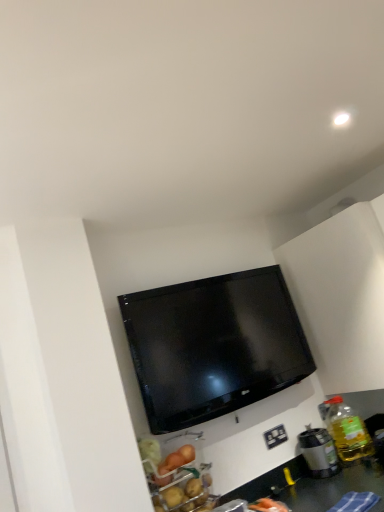
Question: Considering the relative sizes of metallic silver coffee maker at lower right and white plastic electrical outlet at lower right in the image provided, is metallic silver coffee maker at lower right wider than white plastic electrical outlet at lower right?

Choices:
 (A) no
 (B) yes

Answer: (B)

Question: Is white plastic electrical outlet at lower right at the back of metallic silver coffee maker at lower right?

Choices:
 (A) yes
 (B) no

Answer: (B)

Question: From a real-world perspective, is metallic silver coffee maker at lower right located higher than white plastic electrical outlet at lower right?

Choices:
 (A) no
 (B) yes

Answer: (A)

Question: Does metallic silver coffee maker at lower right have a larger size compared to white plastic electrical outlet at lower right?

Choices:
 (A) yes
 (B) no

Answer: (A)

Question: Considering the relative positions of metallic silver coffee maker at lower right and white plastic electrical outlet at lower right in the image provided, is metallic silver coffee maker at lower right to the left of white plastic electrical outlet at lower right from the viewer's perspective?

Choices:
 (A) yes
 (B) no

Answer: (B)

Question: From the image's perspective, is metallic silver coffee maker at lower right located beneath white plastic electrical outlet at lower right?

Choices:
 (A) yes
 (B) no

Answer: (A)

Question: Is translucent yellow bottle at right to the right of metallic silver coffee maker at lower right from the viewer's perspective?

Choices:
 (A) yes
 (B) no

Answer: (A)

Question: Is translucent yellow bottle at right positioned beyond the bounds of metallic silver coffee maker at lower right?

Choices:
 (A) no
 (B) yes

Answer: (B)

Question: Considering the relative sizes of translucent yellow bottle at right and metallic silver coffee maker at lower right in the image provided, is translucent yellow bottle at right wider than metallic silver coffee maker at lower right?

Choices:
 (A) no
 (B) yes

Answer: (B)

Question: Does translucent yellow bottle at right have a larger size compared to metallic silver coffee maker at lower right?

Choices:
 (A) yes
 (B) no

Answer: (A)

Question: Is translucent yellow bottle at right further to the viewer compared to metallic silver coffee maker at lower right?

Choices:
 (A) yes
 (B) no

Answer: (A)

Question: From the image's perspective, is translucent yellow bottle at right on top of metallic silver coffee maker at lower right?

Choices:
 (A) yes
 (B) no

Answer: (A)

Question: Considering the relative sizes of metallic silver coffee maker at lower right and translucent yellow bottle at right in the image provided, is metallic silver coffee maker at lower right taller than translucent yellow bottle at right?

Choices:
 (A) no
 (B) yes

Answer: (A)